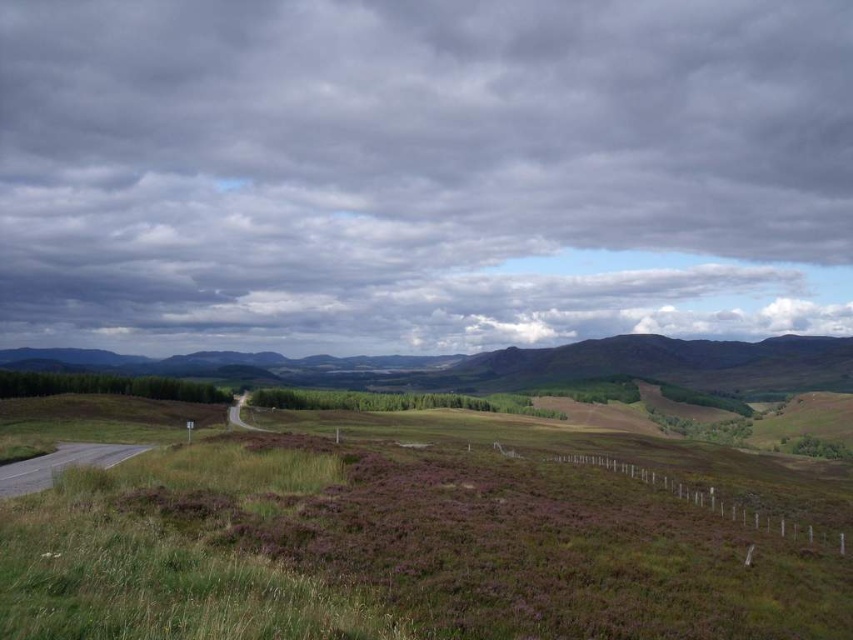
Question: Is cloudy sky at upper center below green grassy field at lower left?

Choices:
 (A) no
 (B) yes

Answer: (A)

Question: Among these objects, which one is farthest from the camera?

Choices:
 (A) green grassy field at lower left
 (B) cloudy sky at upper center

Answer: (B)

Question: Does cloudy sky at upper center have a larger size compared to green grassy field at lower left?

Choices:
 (A) no
 (B) yes

Answer: (B)

Question: Is cloudy sky at upper center positioned before green grassy field at lower left?

Choices:
 (A) no
 (B) yes

Answer: (A)